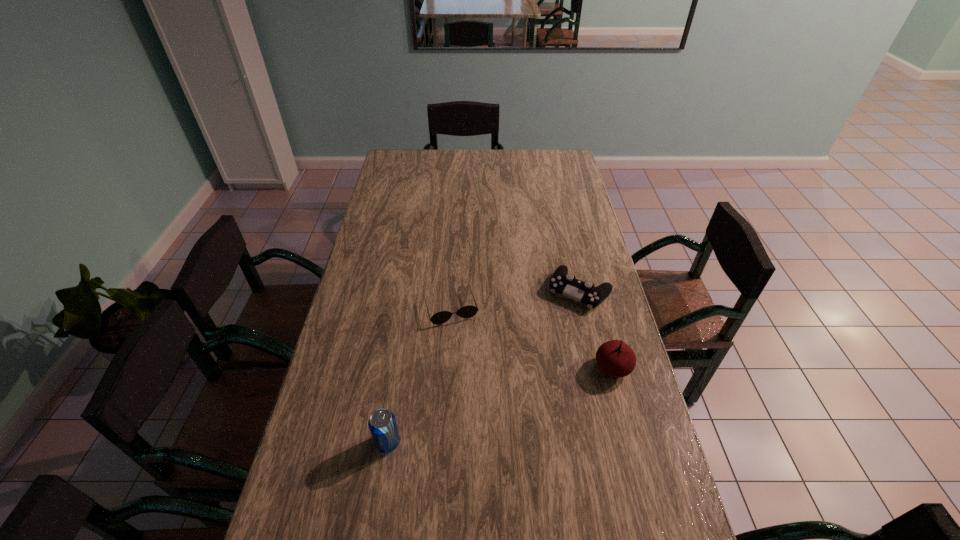
Identify the location of empty space that is in between the control and the third object from right to left. The height and width of the screenshot is (540, 960). (516, 300).

This screenshot has width=960, height=540. I want to click on vacant space that is in between the control and the nearest object, so click(484, 367).

Locate an element on the screen. object that is the third nearest to the sunglasses is located at coordinates (615, 358).

The width and height of the screenshot is (960, 540). In order to click on object that stands as the third closest to the third shortest object in this screenshot , I will do `click(382, 424)`.